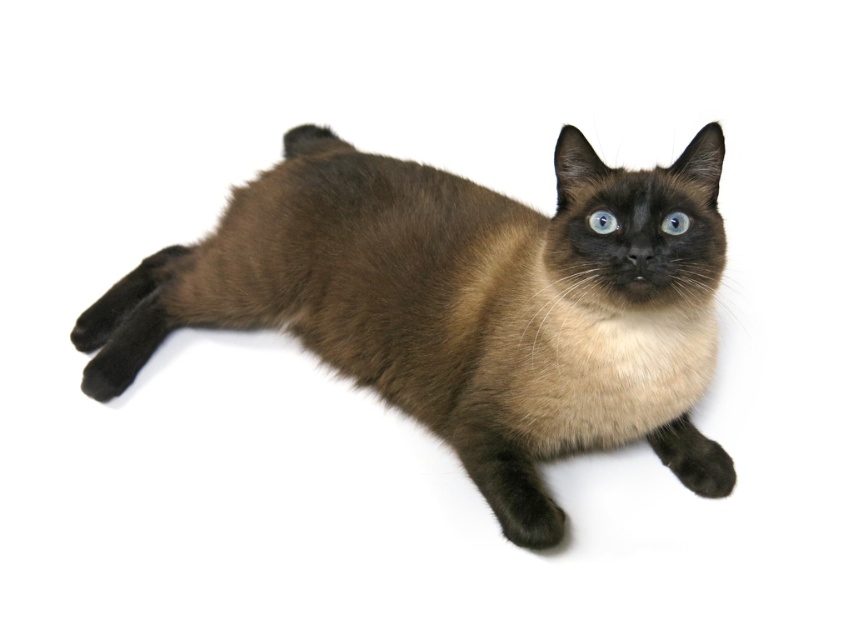
Question: Is brown fur cat at center smaller than blue glossy eye at center?

Choices:
 (A) yes
 (B) no

Answer: (B)

Question: Which object appears farthest from the camera in this image?

Choices:
 (A) blue glossy eye at center
 (B) brown fur cat at center

Answer: (A)

Question: Which object is farther from the camera taking this photo?

Choices:
 (A) blue glossy eye at center
 (B) brown fur cat at center

Answer: (A)

Question: Among these objects, which one is farthest from the camera?

Choices:
 (A) blue glossy eye at center
 (B) brown fur cat at center

Answer: (A)

Question: Can you confirm if brown fur cat at center is smaller than blue glossy eye at center?

Choices:
 (A) yes
 (B) no

Answer: (B)

Question: Can you confirm if brown fur cat at center is positioned to the left of blue glossy eye at center?

Choices:
 (A) yes
 (B) no

Answer: (A)